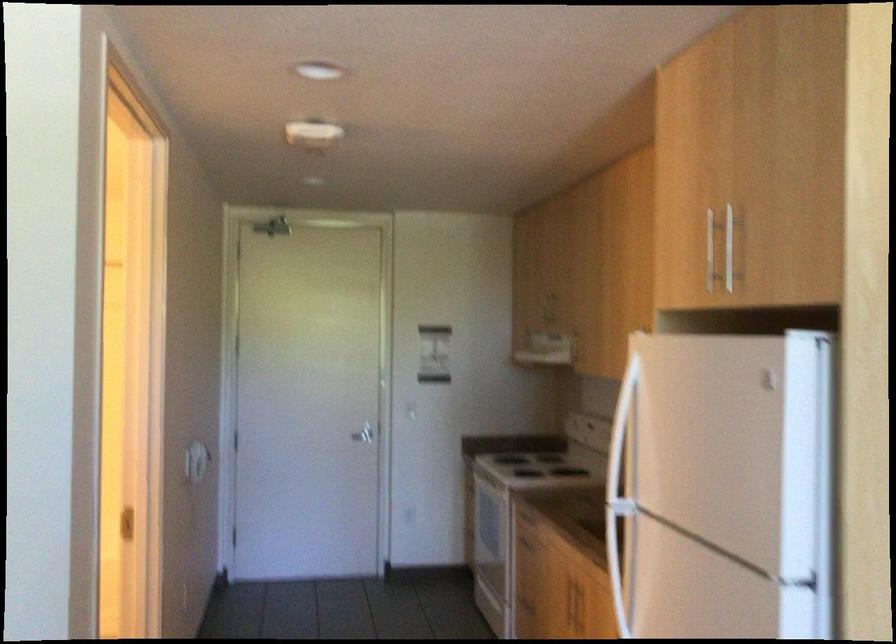
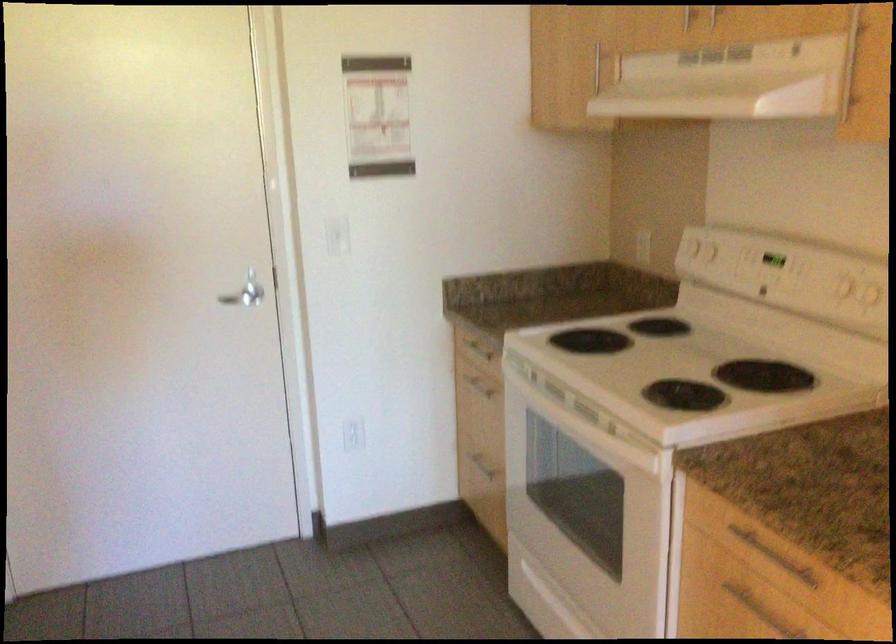
Locate, in the second image, the point that corresponds to (x=419, y=500) in the first image.

(352, 433)